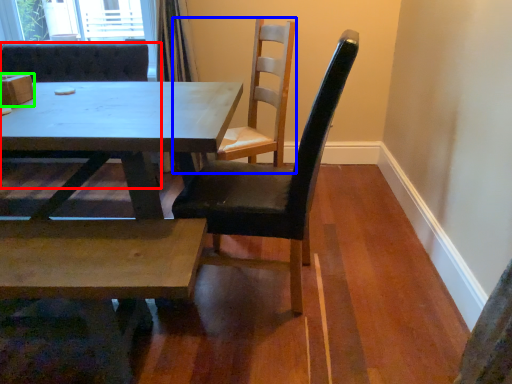
Question: Which object is positioned closest to chair (highlighted by a red box)? Select from chair (highlighted by a blue box) and box (highlighted by a green box).

Choices:
 (A) chair
 (B) box

Answer: (B)